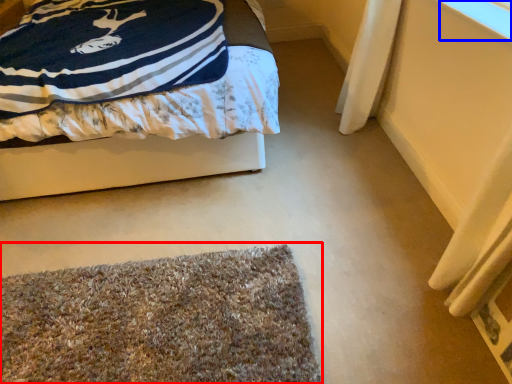
Question: Which point is closer to the camera, mat (highlighted by a red box) or window screen (highlighted by a blue box)?

Choices:
 (A) mat
 (B) window screen

Answer: (A)